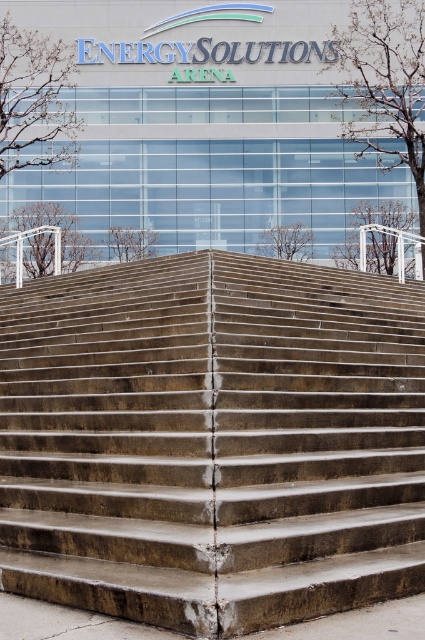
Question: Is concrete stairs at center positioned behind concrete steps at lower center?

Choices:
 (A) yes
 (B) no

Answer: (B)

Question: Is concrete stairs at center above concrete steps at lower center?

Choices:
 (A) no
 (B) yes

Answer: (A)

Question: Is concrete stairs at center below concrete steps at lower center?

Choices:
 (A) no
 (B) yes

Answer: (B)

Question: Which object appears farthest from the camera in this image?

Choices:
 (A) concrete steps at lower center
 (B) concrete stairs at center

Answer: (A)

Question: Among these objects, which one is farthest from the camera?

Choices:
 (A) concrete steps at lower center
 (B) concrete stairs at center

Answer: (A)

Question: Which of the following is the farthest from the observer?

Choices:
 (A) concrete steps at lower center
 (B) concrete stairs at center

Answer: (A)